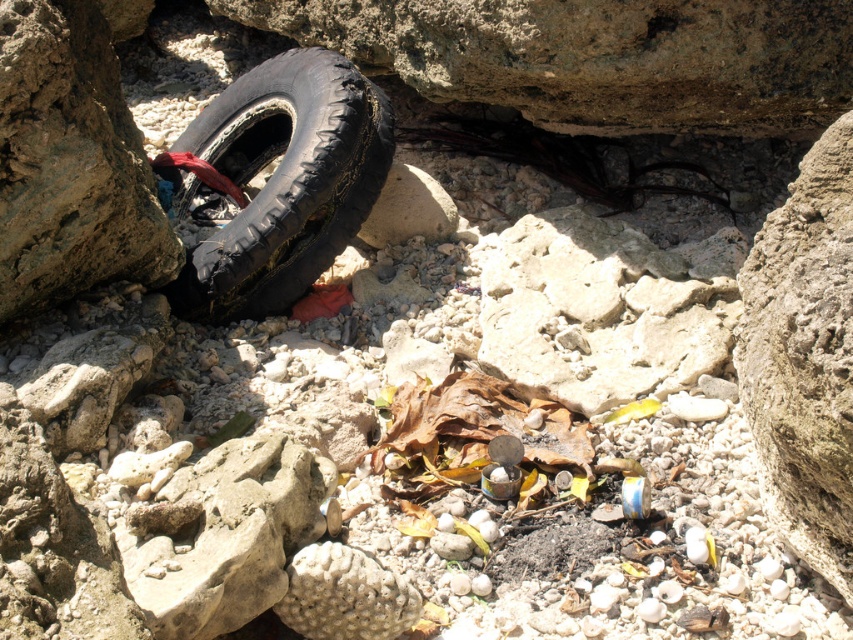
Consider the image. Who is higher up, black rubber tire at left or rough textured rock at center?

black rubber tire at left is above.

Between black rubber tire at left and rough textured rock at center, which one is positioned lower?

Positioned lower is rough textured rock at center.

Does point (363, 132) come farther from viewer compared to point (817, 570)?

Yes, it is behind point (817, 570).

Locate an element on the screen. The height and width of the screenshot is (640, 853). black rubber tire at left is located at coordinates (283, 180).